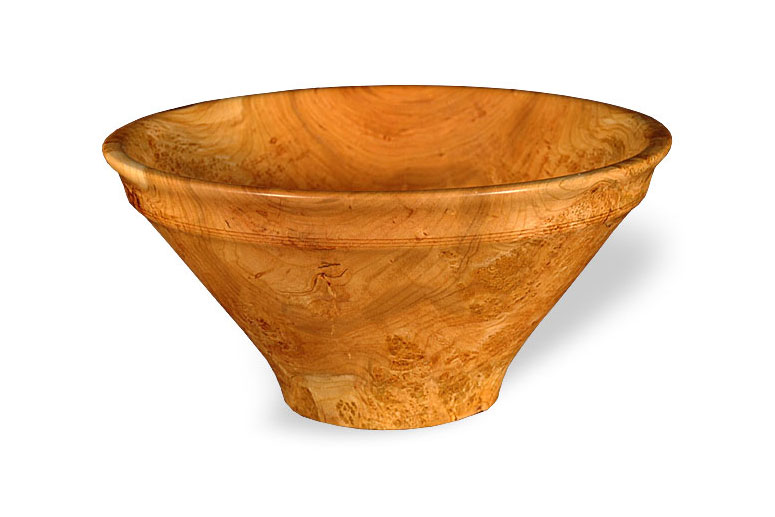
The image size is (775, 517). Find the location of `inside of bowl`. inside of bowl is located at coordinates (394, 167).